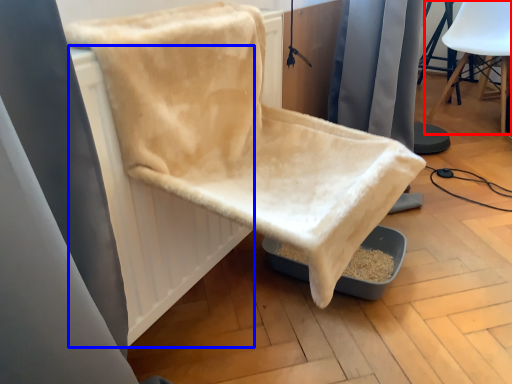
Question: Which point is further to the camera, chair (highlighted by a red box) or radiator (highlighted by a blue box)?

Choices:
 (A) chair
 (B) radiator

Answer: (A)